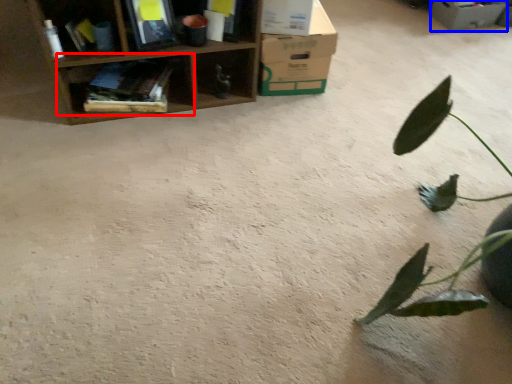
Question: Among these objects, which one is nearest to the camera, shelf (highlighted by a red box) or cardboard box (highlighted by a blue box)?

Choices:
 (A) shelf
 (B) cardboard box

Answer: (A)